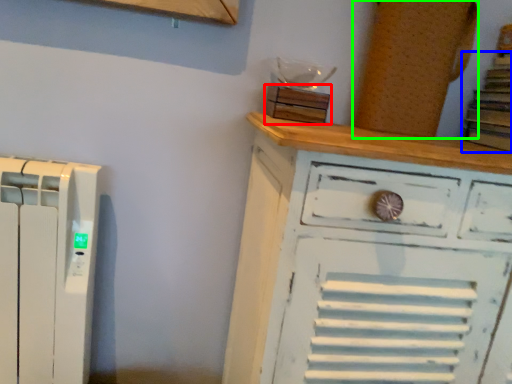
Question: Considering the real-world distances, which object is closest to wood (highlighted by a red box)? book (highlighted by a blue box) or wood (highlighted by a green box).

Choices:
 (A) book
 (B) wood

Answer: (B)